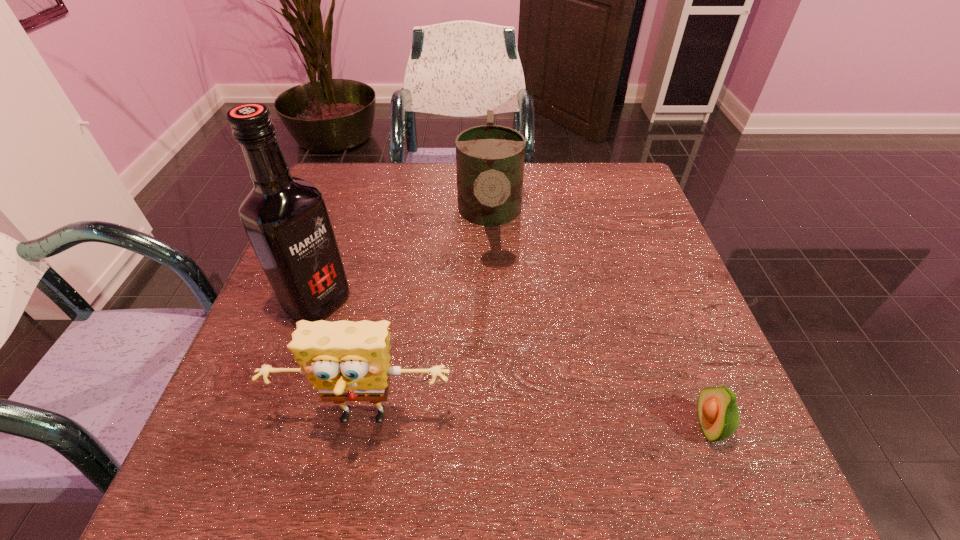
I want to click on object at the right edge, so click(718, 413).

The height and width of the screenshot is (540, 960). I want to click on object that is at the near left corner, so click(x=346, y=361).

Locate an element on the screen. The image size is (960, 540). object positioned at the near right corner is located at coordinates (718, 413).

Locate an element on the screen. The image size is (960, 540). free space at the far edge is located at coordinates (557, 183).

This screenshot has height=540, width=960. In order to click on vacant space at the near edge of the desktop in this screenshot , I will do `click(649, 426)`.

The image size is (960, 540). In order to click on free location at the left edge of the desktop in this screenshot , I will do `click(265, 352)`.

In the image, there is a desktop. Where is `vacant space at the right edge`? vacant space at the right edge is located at coordinates (614, 274).

In the image, there is a desktop. Where is `free region at the far left corner`? The width and height of the screenshot is (960, 540). free region at the far left corner is located at coordinates (336, 198).

Find the location of a particular element. This screenshot has width=960, height=540. vacant space at the far right corner is located at coordinates (589, 196).

Identify the location of vacant area that lies between the sponge and the watering can. The image size is (960, 540). (427, 319).